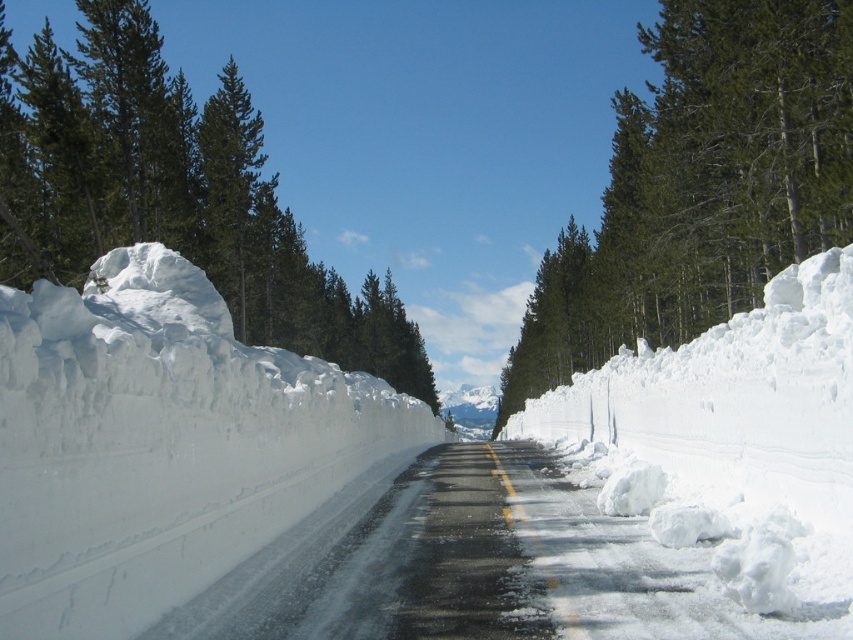
How distant is white fluffy snow at center from green coniferous tree at left?

white fluffy snow at center and green coniferous tree at left are 38.69 meters apart from each other.

Can you confirm if white fluffy snow at center is positioned above green coniferous tree at left?

No, white fluffy snow at center is not above green coniferous tree at left.

The image size is (853, 640). What do you see at coordinates (705, 476) in the screenshot? I see `white fluffy snow at center` at bounding box center [705, 476].

The width and height of the screenshot is (853, 640). I want to click on white fluffy snow at center, so click(x=705, y=476).

Is white fluffy snow at left below green coniferous tree at left?

Indeed, white fluffy snow at left is positioned under green coniferous tree at left.

Looking at this image, does white fluffy snow at left appear on the right side of green coniferous tree at left?

Yes, white fluffy snow at left is to the right of green coniferous tree at left.

Does point (64, 541) come behind point (149, 227)?

No, it is in front of (149, 227).

The image size is (853, 640). I want to click on white fluffy snow at left, so click(160, 444).

Which is behind, point (126, 484) or point (570, 221)?

The point (570, 221) is more distant.

Which is below, white fluffy snow at left or green matte tree at upper center?

→ white fluffy snow at left

What do you see at coordinates (160, 444) in the screenshot?
I see `white fluffy snow at left` at bounding box center [160, 444].

What are the coordinates of `white fluffy snow at left` in the screenshot? It's located at (160, 444).